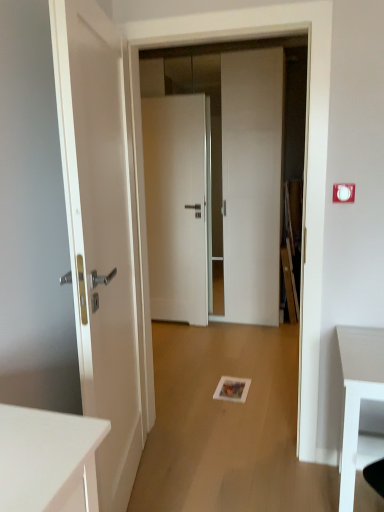
Where is `unoccupied region to the right of white matte door at center, acting as the third door starting from the front`? This screenshot has height=512, width=384. unoccupied region to the right of white matte door at center, acting as the third door starting from the front is located at coordinates (218, 330).